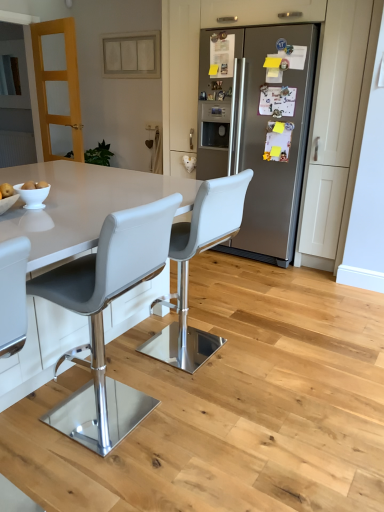
The image size is (384, 512). Find the location of `free space on the front side of white leather stool at center, which is the 2th chair in front-to-back order`. free space on the front side of white leather stool at center, which is the 2th chair in front-to-back order is located at coordinates (205, 396).